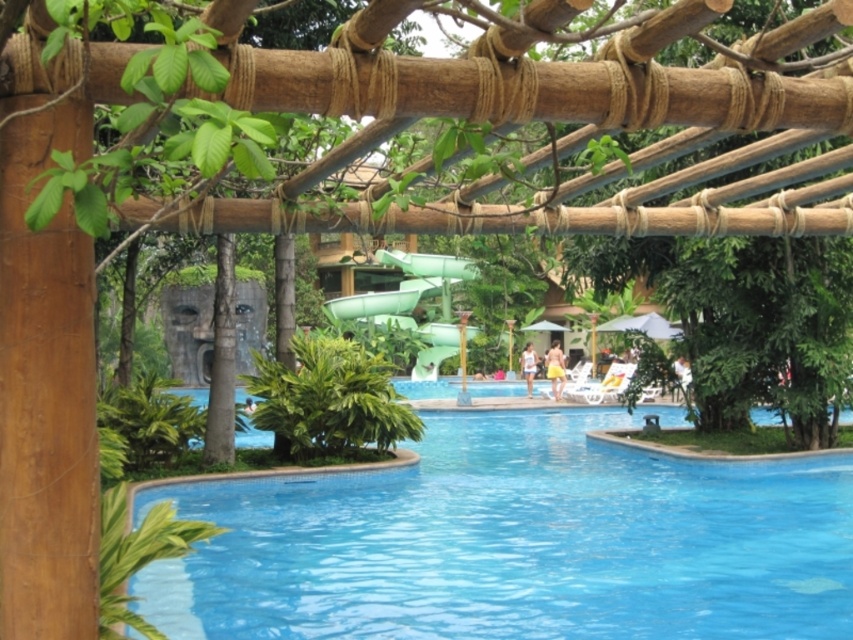
Question: Is blue glossy pool at center positioned behind green rubber slide at center?

Choices:
 (A) no
 (B) yes

Answer: (A)

Question: Can you confirm if blue glossy pool at center is thinner than green rubber slide at center?

Choices:
 (A) yes
 (B) no

Answer: (B)

Question: Is blue glossy pool at center to the left of green rubber slide at center from the viewer's perspective?

Choices:
 (A) no
 (B) yes

Answer: (A)

Question: Which of the following is the closest to the observer?

Choices:
 (A) blue glossy pool at center
 (B) green rubber slide at center

Answer: (A)

Question: Which of the following is the farthest from the observer?

Choices:
 (A) (386, 291)
 (B) (395, 534)

Answer: (A)